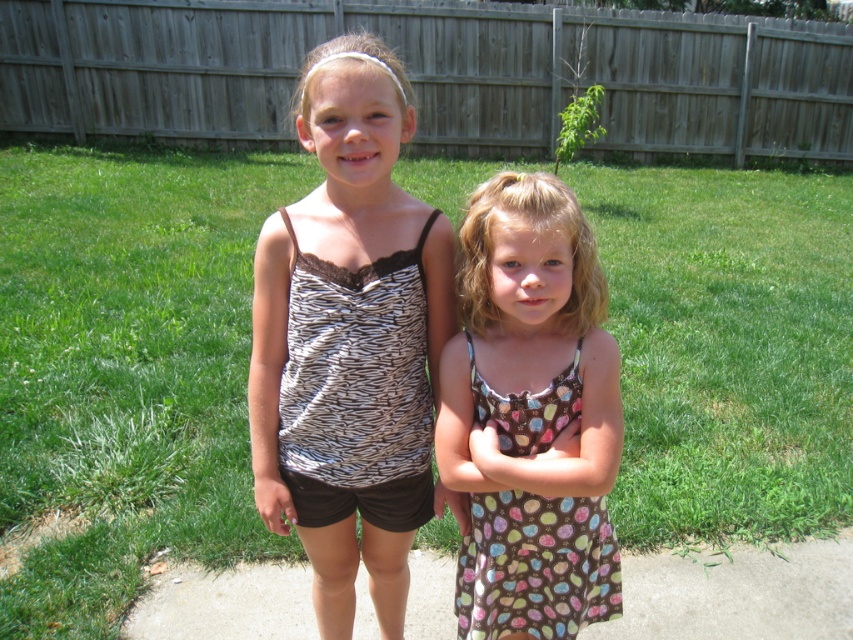
Question: Which object is the farthest from the gray concrete pavement at lower center?

Choices:
 (A) zebra-patterned tank top at center
 (B) brown dotted dress at center

Answer: (A)

Question: Is zebra-patterned tank top at center below gray concrete pavement at lower center?

Choices:
 (A) yes
 (B) no

Answer: (B)

Question: Which of the following is the farthest from the observer?

Choices:
 (A) (357, 620)
 (B) (331, 509)
 (C) (552, 248)

Answer: (A)

Question: Does zebra-patterned tank top at center appear on the right side of gray concrete pavement at lower center?

Choices:
 (A) no
 (B) yes

Answer: (A)

Question: Which of the following is the farthest from the observer?

Choices:
 (A) gray concrete pavement at lower center
 (B) zebra-patterned tank top at center

Answer: (A)

Question: Is zebra-patterned tank top at center bigger than gray concrete pavement at lower center?

Choices:
 (A) yes
 (B) no

Answer: (A)